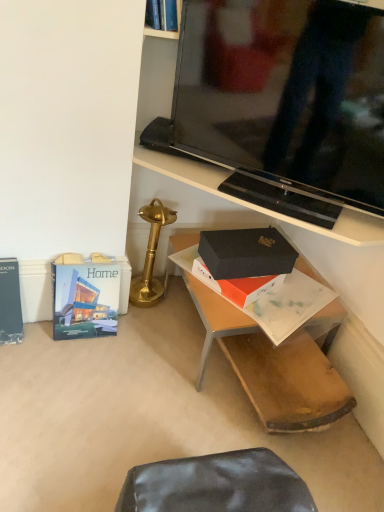
Question: Is gold polished table lamp at center at the back of black glossy tv stand at upper center?

Choices:
 (A) yes
 (B) no

Answer: (B)

Question: Is black glossy tv stand at upper center far from gold polished table lamp at center?

Choices:
 (A) no
 (B) yes

Answer: (A)

Question: Considering the relative positions of black glossy tv stand at upper center and gold polished table lamp at center in the image provided, is black glossy tv stand at upper center to the right of gold polished table lamp at center from the viewer's perspective?

Choices:
 (A) no
 (B) yes

Answer: (B)

Question: Is black glossy tv stand at upper center touching gold polished table lamp at center?

Choices:
 (A) yes
 (B) no

Answer: (B)

Question: Does black glossy tv stand at upper center have a larger size compared to gold polished table lamp at center?

Choices:
 (A) yes
 (B) no

Answer: (A)

Question: Is black glossy tv stand at upper center thinner than gold polished table lamp at center?

Choices:
 (A) no
 (B) yes

Answer: (B)

Question: From a real-world perspective, is hardcover book at lower left, which appears as the 1th paperback book when viewed from the right, located higher than hardcover book at left, positioned as the second paperback book in right-to-left order?

Choices:
 (A) no
 (B) yes

Answer: (A)

Question: From the image's perspective, is hardcover book at lower left, which ranks as the second paperback book in left-to-right order, on top of hardcover book at left, acting as the first paperback book starting from the left?

Choices:
 (A) yes
 (B) no

Answer: (A)

Question: Can you see hardcover book at lower left, which appears as the 1th paperback book when viewed from the right, touching hardcover book at left, positioned as the second paperback book in right-to-left order?

Choices:
 (A) no
 (B) yes

Answer: (A)

Question: Is hardcover book at lower left, which ranks as the second paperback book in left-to-right order, positioned in front of hardcover book at left, positioned as the second paperback book in right-to-left order?

Choices:
 (A) no
 (B) yes

Answer: (A)

Question: From the image's perspective, is hardcover book at lower left, which appears as the 1th paperback book when viewed from the right, under hardcover book at left, positioned as the second paperback book in right-to-left order?

Choices:
 (A) no
 (B) yes

Answer: (A)

Question: Considering the relative positions of hardcover book at lower left, which appears as the 1th paperback book when viewed from the right, and hardcover book at left, acting as the first paperback book starting from the left, in the image provided, is hardcover book at lower left, which appears as the 1th paperback book when viewed from the right, to the right of hardcover book at left, acting as the first paperback book starting from the left, from the viewer's perspective?

Choices:
 (A) no
 (B) yes

Answer: (B)

Question: From a real-world perspective, is hardcover book at lower left, which ranks as the second paperback book in left-to-right order, located beneath black matte box at center?

Choices:
 (A) yes
 (B) no

Answer: (A)